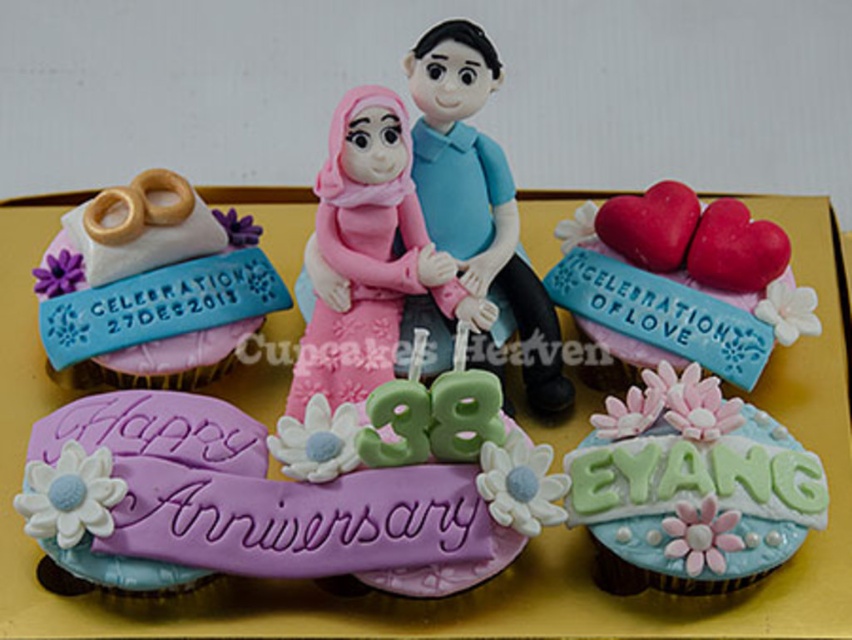
Question: Does pastel blue fondant cupcake with floral decorations at lower right have a lesser width compared to smooth pink heart at center?

Choices:
 (A) yes
 (B) no

Answer: (A)

Question: Which of these objects is positioned farthest from the smooth pink heart at center?

Choices:
 (A) pastel blue fondant cupcake with floral decorations at lower right
 (B) matte pink fabric doll at center

Answer: (B)

Question: Which point is farther to the camera?

Choices:
 (A) (763, 564)
 (B) (534, 403)
 (C) (741, 264)

Answer: (B)

Question: Is smooth pink heart at center to the left of matte pink fabric doll at center from the viewer's perspective?

Choices:
 (A) yes
 (B) no

Answer: (B)

Question: Does white fondant rings at upper left appear under smooth pink heart at center?

Choices:
 (A) yes
 (B) no

Answer: (B)

Question: Which point is closer to the camera taking this photo?

Choices:
 (A) (163, 225)
 (B) (440, 212)
 (C) (793, 461)

Answer: (C)